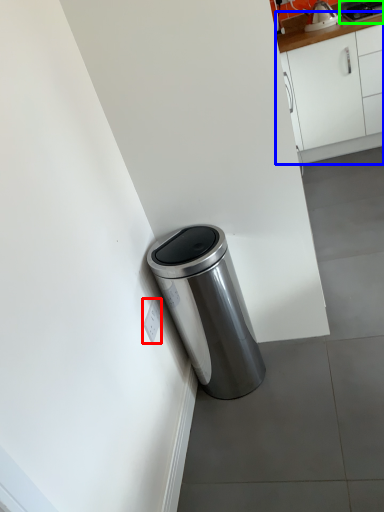
Question: Based on their relative distances, which object is farther from electric outlet (highlighted by a red box)? Choose from cabinetry (highlighted by a blue box) and appliance (highlighted by a green box).

Choices:
 (A) cabinetry
 (B) appliance

Answer: (B)